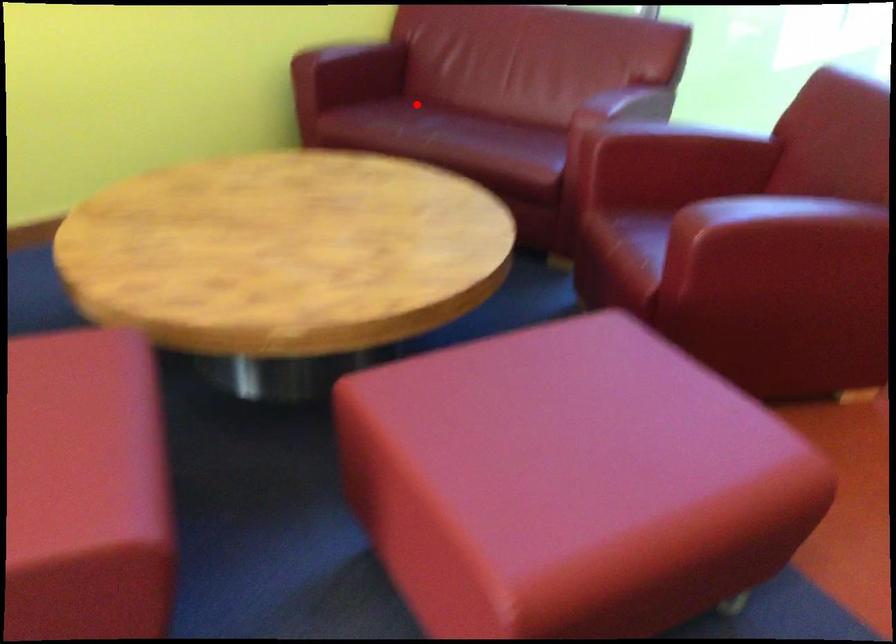
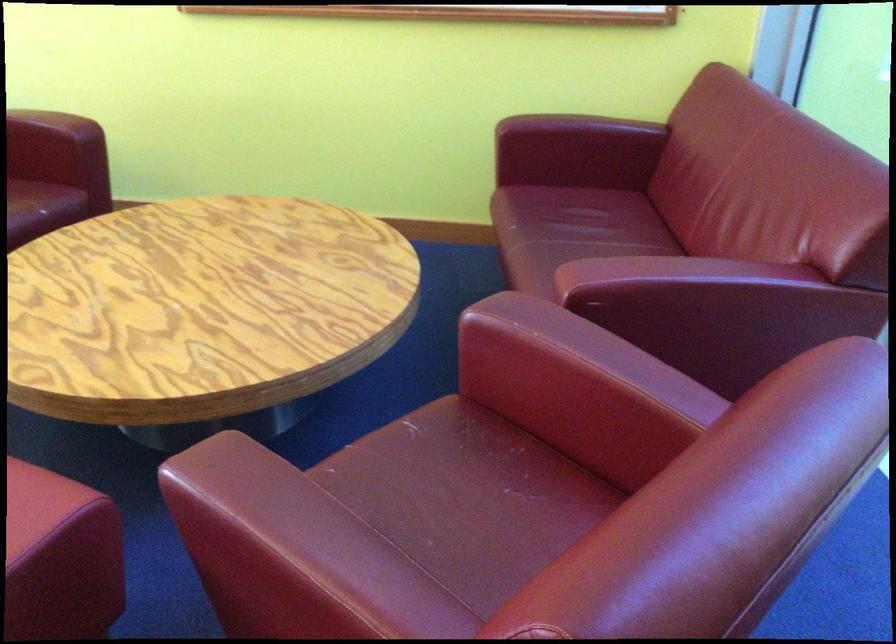
Locate, in the second image, the point that corresponds to the highlighted location in the first image.

(592, 210)